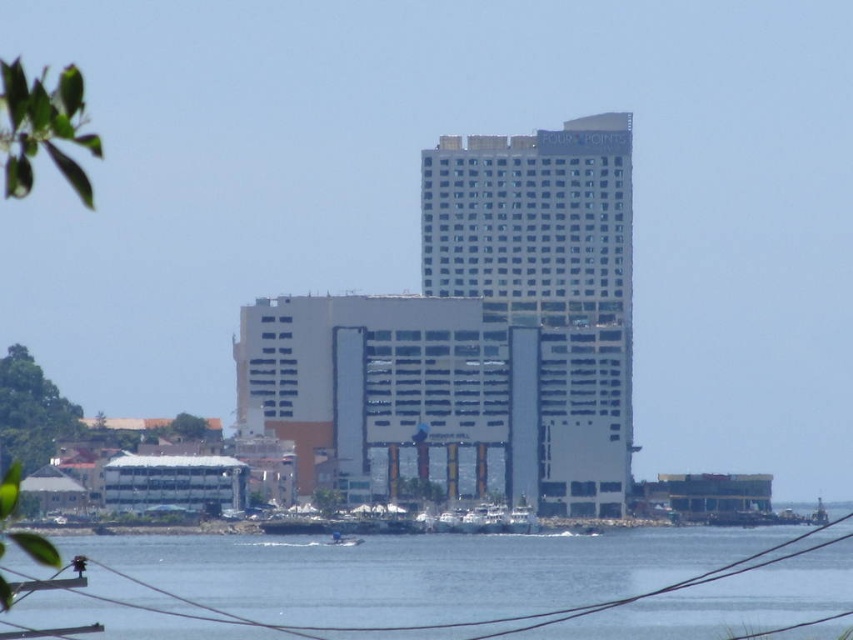
Between point (692, 611) and point (340, 534), which one is positioned in front?

Point (340, 534)

The image size is (853, 640). Find the location of `transparent water at lower center`. transparent water at lower center is located at coordinates (453, 586).

This screenshot has width=853, height=640. Identify the location of transparent water at lower center. (453, 586).

Measure the distance between point (573, 144) and camera.

They are 653.55 meters apart.

Consider the image. Which is more to the right, white glass building at center or blue plastic boat at lower center?

Positioned to the right is white glass building at center.

The image size is (853, 640). I want to click on white glass building at center, so click(x=546, y=294).

This screenshot has width=853, height=640. Find the location of `white glass building at center`. white glass building at center is located at coordinates (546, 294).

Which of these two, transparent water at lower center or white glass building at center, stands shorter?

Standing shorter between the two is transparent water at lower center.

Is transparent water at lower center positioned at the back of white glass building at center?

Yes, it is.

Find the location of `transparent water at lower center`. transparent water at lower center is located at coordinates (453, 586).

At what (x,y) coordinates should I click in order to perform the action: click on transparent water at lower center. Please return your answer as a coordinate pair (x, y). This screenshot has height=640, width=853. Looking at the image, I should click on (453, 586).